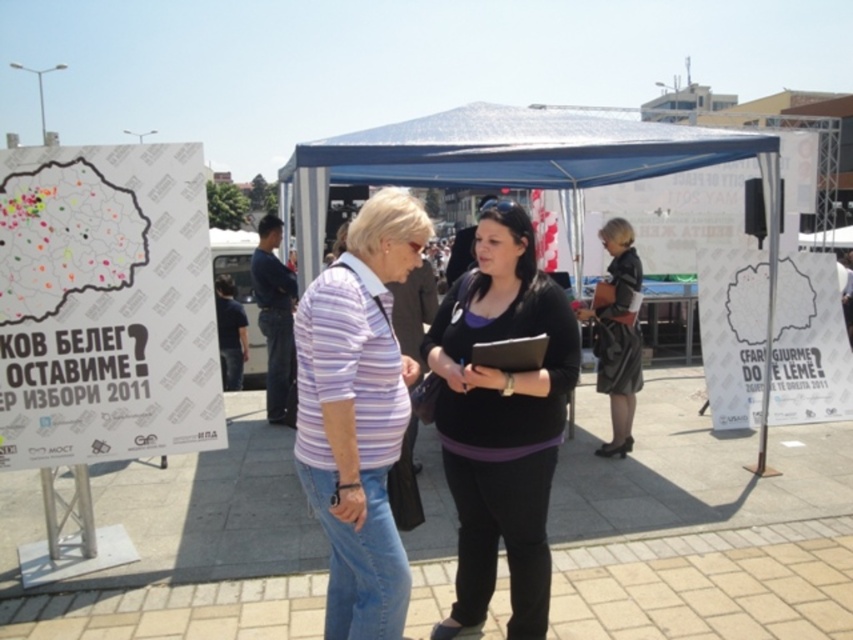
Question: Is black matte shirt at center positioned at the back of black leather skirt at center?

Choices:
 (A) no
 (B) yes

Answer: (A)

Question: Which point appears closest to the camera in this image?

Choices:
 (A) (352, 276)
 (B) (630, 408)

Answer: (A)

Question: Which is farther from the purple striped shirt at center?

Choices:
 (A) black matte shirt at center
 (B) black leather skirt at center

Answer: (B)

Question: Among these points, which one is farthest from the camera?

Choices:
 (A) (350, 600)
 (B) (570, 355)
 (C) (624, 232)

Answer: (C)

Question: Is black matte shirt at center thinner than black leather skirt at center?

Choices:
 (A) yes
 (B) no

Answer: (B)

Question: Is purple striped shirt at center wider than black leather skirt at center?

Choices:
 (A) no
 (B) yes

Answer: (A)